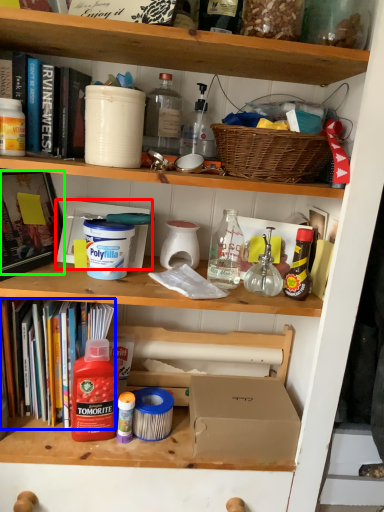
Question: Based on their relative distances, which object is farther from box (highlighted by a red box)? Choose from book (highlighted by a blue box) and book (highlighted by a green box).

Choices:
 (A) book
 (B) book

Answer: (A)